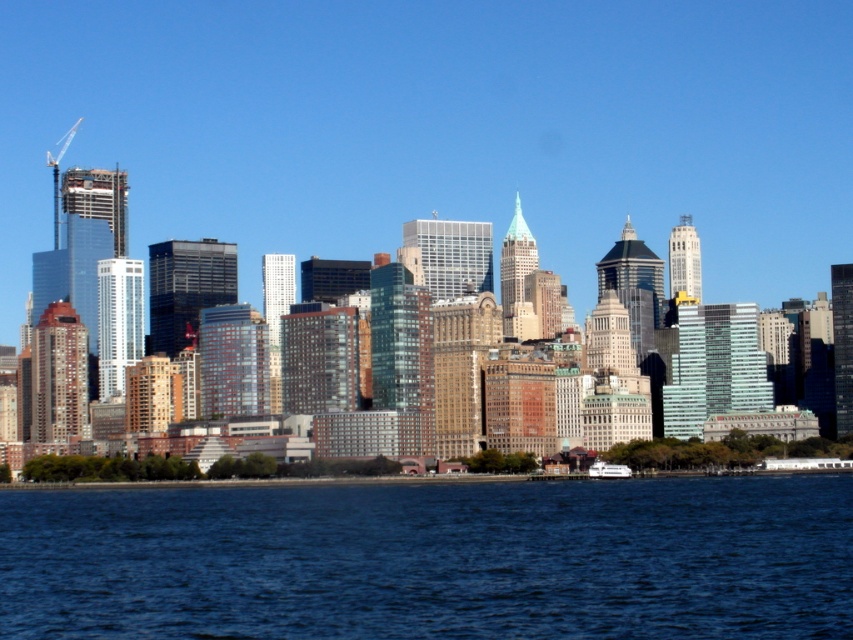
You are a drone operator trying to capture a photo of the city skyline. Your drone is currently hovering at point coordinates of 0.7, 0.5. To avoid obstacles, you need to move it away from the blue liquid water at lower center. Which direction should you move the drone to the left or right? Please provide your answer based on the coordinates provided in the scene description.

The blue liquid water at lower center is located at point coordinates of [432,560]. The drone is at [426,448]. Since the water is to the right of the drone, moving the drone to the left would take it away from the blue liquid water at lower center.

You are standing on the shore looking at the blue liquid water at lower center and the white glossy ferry at lower center. Which object is nearer to you?

The blue liquid water at lower center is closer to the viewer than the white glossy ferry at lower center.

You are a photographer planning to capture the entire city skyline in one shot. You notice the blue liquid water at lower center and the white glossy ferry at lower center. Which object would you need to adjust your camera angle to include in the frame first?

The blue liquid water at lower center has a larger size compared to the white glossy ferry at lower center, so you would need to adjust your camera angle to include the blue liquid water at lower center first to ensure it fits entirely within the frame.